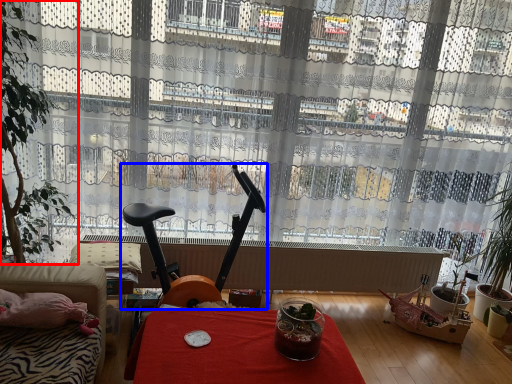
Question: Which of the following is the closest to the observer, houseplant (highlighted by a red box) or swivel chair (highlighted by a blue box)?

Choices:
 (A) houseplant
 (B) swivel chair

Answer: (A)